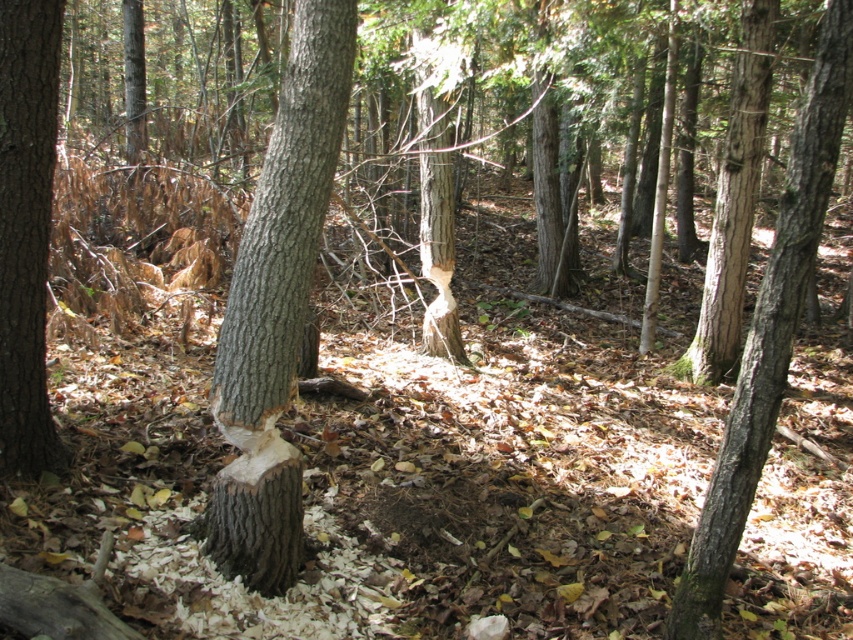
Question: Which of the following is the farthest from the observer?

Choices:
 (A) (227, 301)
 (B) (757, 410)

Answer: (A)

Question: Among these objects, which one is farthest from the camera?

Choices:
 (A) smooth gray bark at center
 (B) smooth bark tree at center
 (C) smooth brown bark at left

Answer: (C)

Question: Among these points, which one is nearest to the camera?

Choices:
 (A) (289, 292)
 (B) (9, 88)
 (C) (781, 292)

Answer: (C)

Question: Is smooth gray bark at center closer to camera compared to smooth brown bark at left?

Choices:
 (A) no
 (B) yes

Answer: (B)

Question: Is smooth gray bark at center behind smooth brown bark at left?

Choices:
 (A) yes
 (B) no

Answer: (B)

Question: Does smooth gray bark at center appear under smooth brown bark at left?

Choices:
 (A) no
 (B) yes

Answer: (B)